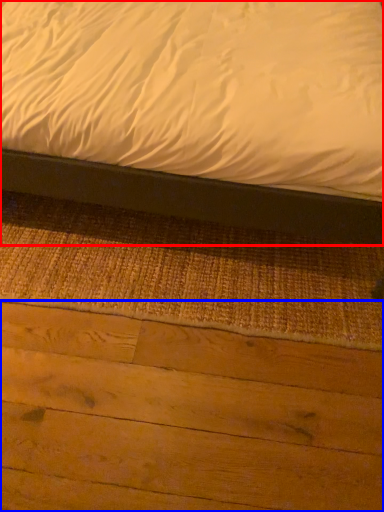
Question: Which point is further to the camera, bed (highlighted by a red box) or plywood (highlighted by a blue box)?

Choices:
 (A) bed
 (B) plywood

Answer: (B)